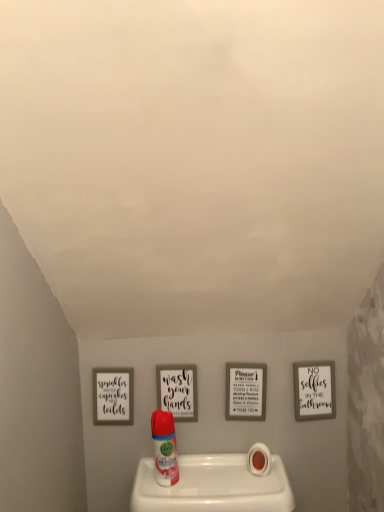
What is the approximate width of white matte toilet paper at lower center?

white matte toilet paper at lower center is 2.91 inches wide.

This screenshot has width=384, height=512. Find the location of `white matte toilet paper at lower center`. white matte toilet paper at lower center is located at coordinates (259, 459).

Measure the distance between point (254,474) and camera.

Point (254,474) is 3.92 feet from camera.

What do you see at coordinates (259, 459) in the screenshot? The height and width of the screenshot is (512, 384). I see `white matte toilet paper at lower center` at bounding box center [259, 459].

This screenshot has width=384, height=512. Describe the element at coordinates (164, 448) in the screenshot. I see `translucent plastic air freshener at center` at that location.

Identify the location of translucent plastic air freshener at center. The height and width of the screenshot is (512, 384). (164, 448).

Image resolution: width=384 pixels, height=512 pixels. In order to click on white matte toilet paper at lower center in this screenshot , I will do `click(259, 459)`.

Which is more to the right, translucent plastic air freshener at center or white matte toilet paper at lower center?

white matte toilet paper at lower center is more to the right.

Which object is closer to the camera, translucent plastic air freshener at center or white matte toilet paper at lower center?

translucent plastic air freshener at center is in front.

Considering the points (172, 473) and (256, 470), which point is behind, point (172, 473) or point (256, 470)?

The point (256, 470) is farther.

From the image's perspective, which is below, translucent plastic air freshener at center or white matte toilet paper at lower center?

white matte toilet paper at lower center appears lower in the image.

From a real-world perspective, between translucent plastic air freshener at center and white matte toilet paper at lower center, who is vertically higher?

From a 3D spatial view, translucent plastic air freshener at center is above.

Does translucent plastic air freshener at center have a lesser width compared to white matte toilet paper at lower center?

Yes, translucent plastic air freshener at center is thinner than white matte toilet paper at lower center.

Is translucent plastic air freshener at center taller than white matte toilet paper at lower center?

Indeed, translucent plastic air freshener at center has a greater height compared to white matte toilet paper at lower center.

Considering the sizes of objects translucent plastic air freshener at center and white matte toilet paper at lower center in the image provided, who is smaller, translucent plastic air freshener at center or white matte toilet paper at lower center?

With smaller size is white matte toilet paper at lower center.

Which is correct: translucent plastic air freshener at center is inside white matte toilet paper at lower center, or outside of it?

translucent plastic air freshener at center cannot be found inside white matte toilet paper at lower center.

Is translucent plastic air freshener at center far from white matte toilet paper at lower center?

No, translucent plastic air freshener at center is not far from white matte toilet paper at lower center.

Is translucent plastic air freshener at center oriented towards white matte toilet paper at lower center?

No, translucent plastic air freshener at center does not turn towards white matte toilet paper at lower center.

How different are the orientations of translucent plastic air freshener at center and white matte toilet paper at lower center in degrees?

The angular difference between translucent plastic air freshener at center and white matte toilet paper at lower center is 0.00779 degrees.

In the scene shown: How far apart are translucent plastic air freshener at center and white matte toilet paper at lower center?

translucent plastic air freshener at center and white matte toilet paper at lower center are 25.13 centimeters apart.

Where is `cleaning product above the white matte toilet paper at lower center (from the image's perspective)`? This screenshot has width=384, height=512. cleaning product above the white matte toilet paper at lower center (from the image's perspective) is located at coordinates (164, 448).

Is white matte toilet paper at lower center to the left or to the right of translucent plastic air freshener at center in the image?

Based on their positions, white matte toilet paper at lower center is located to the right of translucent plastic air freshener at center.

Is white matte toilet paper at lower center closer to the viewer compared to translucent plastic air freshener at center?

No, white matte toilet paper at lower center is behind translucent plastic air freshener at center.

Is point (261, 470) positioned in front of point (168, 436)?

No, (261, 470) is behind (168, 436).

From the image's perspective, which is below, white matte toilet paper at lower center or translucent plastic air freshener at center?

white matte toilet paper at lower center.

In the scene shown: From a real-world perspective, is white matte toilet paper at lower center on translucent plastic air freshener at center?

No, from a real-world perspective, white matte toilet paper at lower center is not on top of translucent plastic air freshener at center.

Between white matte toilet paper at lower center and translucent plastic air freshener at center, which one has smaller width?

Thinner between the two is translucent plastic air freshener at center.

Considering the sizes of white matte toilet paper at lower center and translucent plastic air freshener at center in the image, is white matte toilet paper at lower center taller or shorter than translucent plastic air freshener at center?

Considering their sizes, white matte toilet paper at lower center has less height than translucent plastic air freshener at center.

Is white matte toilet paper at lower center smaller than translucent plastic air freshener at center?

Yes.

Would you say white matte toilet paper at lower center is outside translucent plastic air freshener at center?

Indeed, white matte toilet paper at lower center is completely outside translucent plastic air freshener at center.

Is white matte toilet paper at lower center with translucent plastic air freshener at center?

No, white matte toilet paper at lower center is not in contact with translucent plastic air freshener at center.

Is translucent plastic air freshener at center at the back of white matte toilet paper at lower center?

That's not correct — white matte toilet paper at lower center is not looking away from translucent plastic air freshener at center.

How many degrees apart are the facing directions of white matte toilet paper at lower center and translucent plastic air freshener at center?

The facing directions of white matte toilet paper at lower center and translucent plastic air freshener at center are 0.00779 degrees apart.

Could you measure the distance between white matte toilet paper at lower center and translucent plastic air freshener at center?

A distance of 9.90 inches exists between white matte toilet paper at lower center and translucent plastic air freshener at center.

You are a GUI agent. You are given a task and a screenshot of the screen. Output one action in this format:
    pyautogui.click(x=<x>, y=<y>)
    Task: Click on the cleaning product above the white matte toilet paper at lower center (from a real-world perspective)
    The width and height of the screenshot is (384, 512).
    Given the screenshot: What is the action you would take?
    pyautogui.click(x=164, y=448)

Where is `cleaning product located in front of the white matte toilet paper at lower center`? This screenshot has width=384, height=512. cleaning product located in front of the white matte toilet paper at lower center is located at coordinates (164, 448).

This screenshot has width=384, height=512. In order to click on toilet paper behind the translucent plastic air freshener at center in this screenshot , I will do `click(259, 459)`.